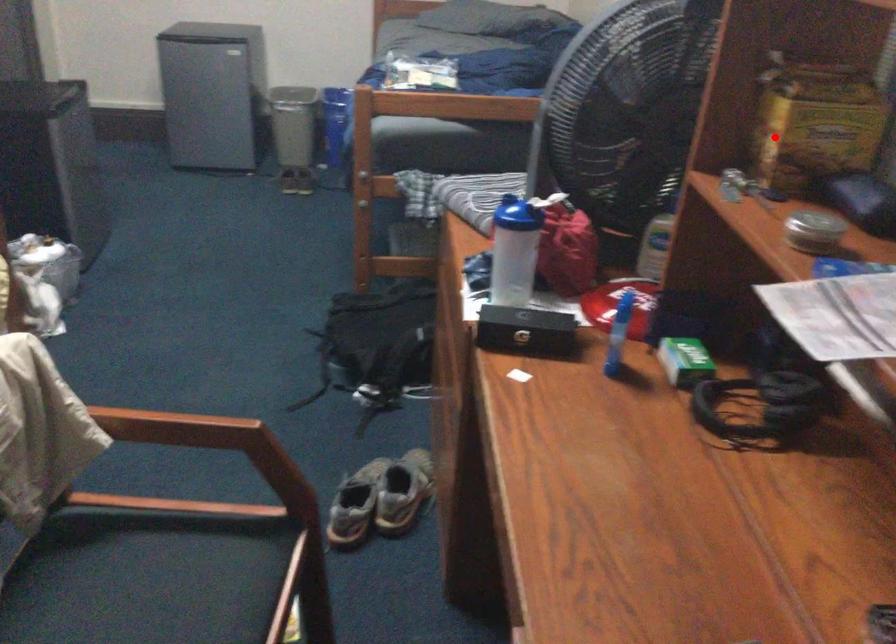
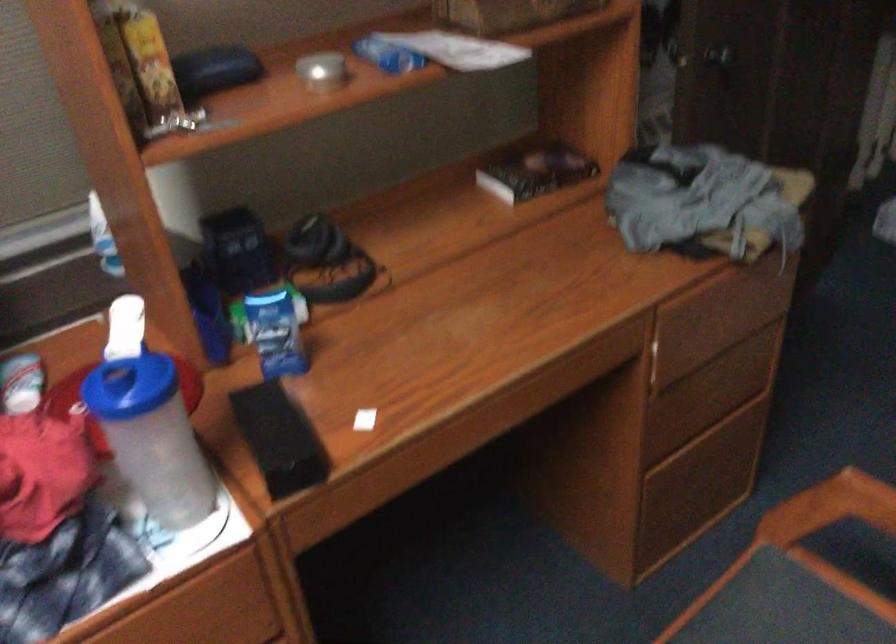
Where in the second image is the point corresponding to the highlighted location from the first image?

(149, 61)